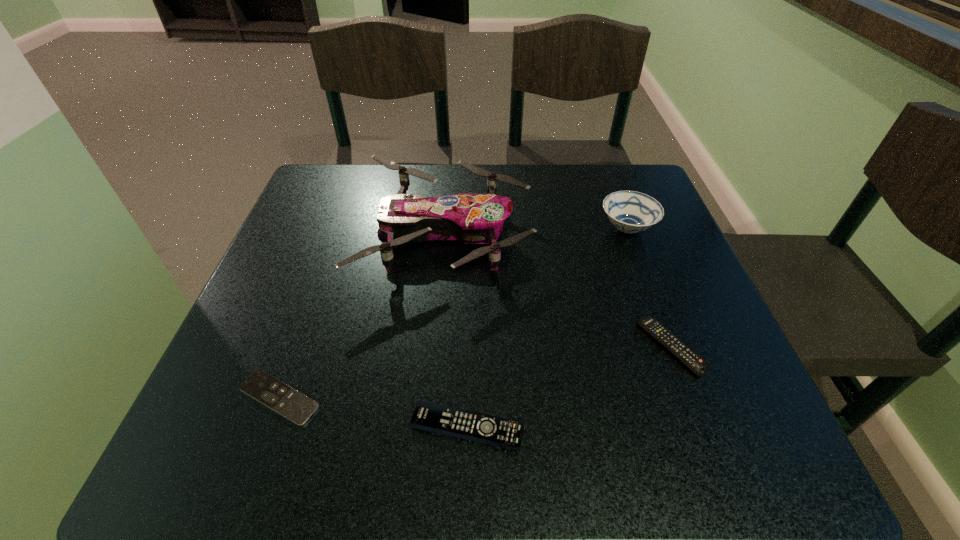
Where is `vacant space that satisfies the following two spatial constraints: 1. on the back side of the soup bowl; 2. on the right side of the leftmost remote control`? vacant space that satisfies the following two spatial constraints: 1. on the back side of the soup bowl; 2. on the right side of the leftmost remote control is located at coordinates (340, 228).

At what (x,y) coordinates should I click in order to perform the action: click on vacant space that satisfies the following two spatial constraints: 1. on the back side of the soup bowl; 2. on the left side of the rightmost remote control. Please return your answer as a coordinate pair (x, y). Image resolution: width=960 pixels, height=540 pixels. Looking at the image, I should click on (626, 228).